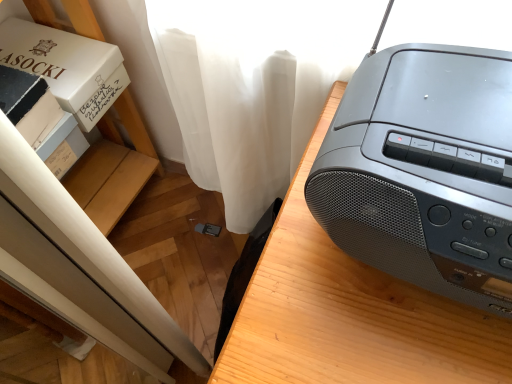
Question: Is matte black radio at upper right situated inside matte black boombox at right or outside?

Choices:
 (A) inside
 (B) outside

Answer: (B)

Question: From their relative heights in the image, would you say matte black radio at upper right is taller or shorter than matte black boombox at right?

Choices:
 (A) tall
 (B) short

Answer: (B)

Question: Which of these objects is positioned farthest from the white cardboard box at left?

Choices:
 (A) white cardboard box at upper left
 (B) white cardboard box at upper left
 (C) matte black radio at upper right
 (D) matte black boombox at right

Answer: (C)

Question: Which object is the farthest from the matte black radio at upper right?

Choices:
 (A) white cardboard box at left
 (B) matte black boombox at right
 (C) white cardboard box at upper left
 (D) white cardboard box at upper left

Answer: (C)